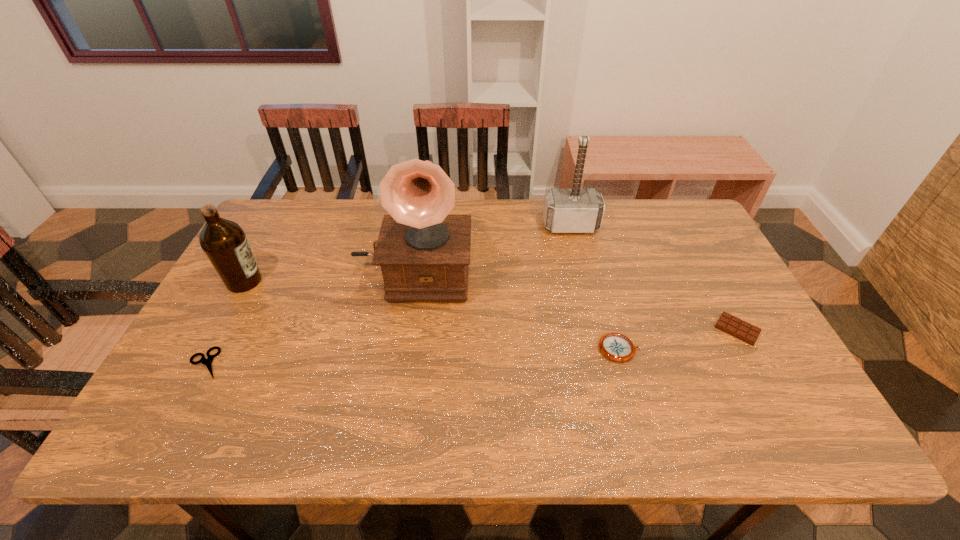
Identify the location of vacant space located for striking with the head of the second tallest object. This screenshot has height=540, width=960. (577, 254).

Where is `free location located on the label of the fourth shortest object`? The image size is (960, 540). free location located on the label of the fourth shortest object is located at coordinates (366, 281).

Find the location of a particular element. The width and height of the screenshot is (960, 540). vacant space positioned on the front of the third shortest object is located at coordinates (633, 396).

Locate an element on the screen. free space located on the back of the fifth tallest object is located at coordinates (708, 275).

The image size is (960, 540). I want to click on blank area located 0.300m on the right of the shortest object, so click(346, 363).

Where is `record player that is at the far edge`? record player that is at the far edge is located at coordinates (424, 252).

This screenshot has width=960, height=540. In order to click on hammer positioned at the far edge in this screenshot , I will do `click(575, 210)`.

Identify the location of olive oil that is positioned at the left edge. (224, 242).

You are a GUI agent. You are given a task and a screenshot of the screen. Output one action in this format:
    pyautogui.click(x=<x>, y=<y>)
    Task: Click on the shears situated at the left edge
    The image size is (960, 540).
    Given the screenshot: What is the action you would take?
    pyautogui.click(x=208, y=362)

At what (x,y) coordinates should I click in order to perform the action: click on object that is at the right edge. Please return your answer as a coordinate pair (x, y). The width and height of the screenshot is (960, 540). Looking at the image, I should click on (736, 327).